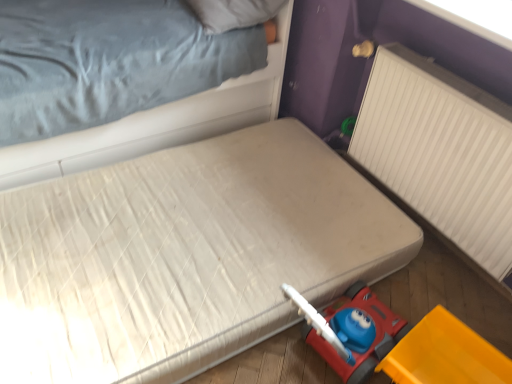
The image size is (512, 384). I want to click on white fabric bed at upper left, marked as the 1th bed in a top-to-bottom arrangement, so [156, 124].

In order to face white fabric bed at upper left, acting as the second bed starting from the bottom, should I rotate leftwards or rightwards?

Turn left approximately 17.500 degrees to face it.

The image size is (512, 384). What are the coordinates of `white ribbed radiator at right` in the screenshot? It's located at (440, 151).

Locate an element on the screen. white fabric bed at upper left, acting as the second bed starting from the bottom is located at coordinates (156, 124).

Between white fabric bed at upper left, marked as the 1th bed in a top-to-bottom arrangement, and white quilted mattress at lower right, marked as the 2th bed in a top-to-bottom arrangement, which one is positioned behind?

white fabric bed at upper left, marked as the 1th bed in a top-to-bottom arrangement, is further from the camera.

Considering the sizes of objects white fabric bed at upper left, marked as the 1th bed in a top-to-bottom arrangement, and white quilted mattress at lower right, marked as the 2th bed in a top-to-bottom arrangement, in the image provided, who is smaller, white fabric bed at upper left, marked as the 1th bed in a top-to-bottom arrangement, or white quilted mattress at lower right, marked as the 2th bed in a top-to-bottom arrangement,?

Smaller between the two is white quilted mattress at lower right, marked as the 2th bed in a top-to-bottom arrangement.

Which point is more forward, (209, 129) or (109, 196)?

The point (109, 196) is closer.

Are white fabric bed at upper left, acting as the second bed starting from the bottom, and white ribbed radiator at right located far from each other?

They are positioned close to each other.

Find the location of a particular element. This screenshot has width=512, height=384. radiator below the white fabric bed at upper left, acting as the second bed starting from the bottom (from a real-world perspective) is located at coordinates (440, 151).

Is white fabric bed at upper left, marked as the 1th bed in a top-to-bottom arrangement, taller than white ribbed radiator at right?

Indeed, white fabric bed at upper left, marked as the 1th bed in a top-to-bottom arrangement, has a greater height compared to white ribbed radiator at right.

In the scene shown: Is white fabric bed at upper left, marked as the 1th bed in a top-to-bottom arrangement, facing away from white ribbed radiator at right?

No, white ribbed radiator at right is not at the back of white fabric bed at upper left, marked as the 1th bed in a top-to-bottom arrangement.

Would you say white soft pillow at upper center is part of white fabric bed at upper left, acting as the second bed starting from the bottom,'s contents?

Yes, white fabric bed at upper left, acting as the second bed starting from the bottom, contains white soft pillow at upper center.

Considering the positions of points (277, 23) and (264, 18), is point (277, 23) closer to camera compared to point (264, 18)?

No, (277, 23) is behind (264, 18).

Is white fabric bed at upper left, acting as the second bed starting from the bottom, to the left or to the right of white soft pillow at upper center in the image?

Clearly, white fabric bed at upper left, acting as the second bed starting from the bottom, is on the left of white soft pillow at upper center in the image.

Is yellow plastic toy car at lower right placed right next to white soft pillow at upper center?

yellow plastic toy car at lower right and white soft pillow at upper center are not in contact.

Is yellow plastic toy car at lower right completely or partially outside of white soft pillow at upper center?

yellow plastic toy car at lower right is positioned outside white soft pillow at upper center.

In the scene shown: From a real-world perspective, between yellow plastic toy car at lower right and white soft pillow at upper center, who is vertically higher?

From a 3D spatial view, white soft pillow at upper center is above.

In the image, is yellow plastic toy car at lower right positioned in front of or behind white soft pillow at upper center?

In the image, yellow plastic toy car at lower right appears in front of white soft pillow at upper center.

Is white quilted mattress at lower right, the first bed when ordered from bottom to top, a part of white ribbed radiator at right?

No, white quilted mattress at lower right, the first bed when ordered from bottom to top, is not a part of white ribbed radiator at right.

Does white ribbed radiator at right have a larger size compared to white quilted mattress at lower right, the first bed when ordered from bottom to top?

Incorrect, white ribbed radiator at right is not larger than white quilted mattress at lower right, the first bed when ordered from bottom to top.

This screenshot has height=384, width=512. In order to click on bed in front of the white ribbed radiator at right in this screenshot , I will do `click(184, 255)`.

How different are the orientations of white ribbed radiator at right and white quilted mattress at lower right, marked as the 2th bed in a top-to-bottom arrangement, in degrees?

0.949 degrees separate the facing orientations of white ribbed radiator at right and white quilted mattress at lower right, marked as the 2th bed in a top-to-bottom arrangement.

Does white soft pillow at upper center have a greater height compared to white quilted mattress at lower right, the first bed when ordered from bottom to top?

No.

In order to click on pillow above the white quilted mattress at lower right, the first bed when ordered from bottom to top (from a real-world perspective) in this screenshot , I will do `click(233, 13)`.

From the image's perspective, relative to white quilted mattress at lower right, marked as the 2th bed in a top-to-bottom arrangement, is white soft pillow at upper center above or below?

From the image's perspective, white soft pillow at upper center appears above white quilted mattress at lower right, marked as the 2th bed in a top-to-bottom arrangement.

Which object is closer to the camera taking this photo, white soft pillow at upper center or white quilted mattress at lower right, the first bed when ordered from bottom to top?

Positioned in front is white quilted mattress at lower right, the first bed when ordered from bottom to top.

Image resolution: width=512 pixels, height=384 pixels. Identify the location of pillow above the white ribbed radiator at right (from a real-world perspective). (233, 13).

Is white ribbed radiator at right further to camera compared to white soft pillow at upper center?

No, white ribbed radiator at right is closer to the camera.

From the image's perspective, is white ribbed radiator at right over white soft pillow at upper center?

No.

Is white ribbed radiator at right thinner than white soft pillow at upper center?

Yes, white ribbed radiator at right is thinner than white soft pillow at upper center.

Locate an element on the screen. The height and width of the screenshot is (384, 512). bed below the white fabric bed at upper left, acting as the second bed starting from the bottom (from the image's perspective) is located at coordinates (184, 255).

The image size is (512, 384). I want to click on radiator in front of the white fabric bed at upper left, marked as the 1th bed in a top-to-bottom arrangement, so click(440, 151).

Which object lies further to the anchor point yellow plastic toy car at lower right, white ribbed radiator at right or white quilted mattress at lower right, marked as the 2th bed in a top-to-bottom arrangement?

The object further to yellow plastic toy car at lower right is white quilted mattress at lower right, marked as the 2th bed in a top-to-bottom arrangement.

From the image, which object appears to be farther from white fabric bed at upper left, marked as the 1th bed in a top-to-bottom arrangement, yellow plastic toy car at lower right or white soft pillow at upper center?

yellow plastic toy car at lower right is further to white fabric bed at upper left, marked as the 1th bed in a top-to-bottom arrangement.

Considering their positions, is yellow plastic toy car at lower right positioned further to white soft pillow at upper center than white ribbed radiator at right?

The object further to white soft pillow at upper center is yellow plastic toy car at lower right.

Based on their spatial positions, is white quilted mattress at lower right, marked as the 2th bed in a top-to-bottom arrangement, or white soft pillow at upper center closer to white fabric bed at upper left, acting as the second bed starting from the bottom?

Based on the image, white soft pillow at upper center appears to be nearer to white fabric bed at upper left, acting as the second bed starting from the bottom.

When comparing their distances from yellow plastic toy car at lower right, does white fabric bed at upper left, marked as the 1th bed in a top-to-bottom arrangement, or white ribbed radiator at right seem further?

white fabric bed at upper left, marked as the 1th bed in a top-to-bottom arrangement, lies further to yellow plastic toy car at lower right than the other object.

Based on their spatial positions, is white quilted mattress at lower right, marked as the 2th bed in a top-to-bottom arrangement, or white ribbed radiator at right further from white fabric bed at upper left, acting as the second bed starting from the bottom?

Based on the image, white ribbed radiator at right appears to be further to white fabric bed at upper left, acting as the second bed starting from the bottom.

Estimate the real-world distances between objects in this image. Which object is further from yellow plastic toy car at lower right, white quilted mattress at lower right, marked as the 2th bed in a top-to-bottom arrangement, or white ribbed radiator at right?

Among the two, white quilted mattress at lower right, marked as the 2th bed in a top-to-bottom arrangement, is located further to yellow plastic toy car at lower right.

Considering their positions, is white quilted mattress at lower right, marked as the 2th bed in a top-to-bottom arrangement, positioned closer to yellow plastic toy car at lower right than white soft pillow at upper center?

white quilted mattress at lower right, marked as the 2th bed in a top-to-bottom arrangement.

Identify the location of equipment located between white quilted mattress at lower right, marked as the 2th bed in a top-to-bottom arrangement, and white ribbed radiator at right in the left-right direction. (445, 354).

Identify the location of radiator between white soft pillow at upper center and white quilted mattress at lower right, the first bed when ordered from bottom to top, in the vertical direction. This screenshot has width=512, height=384. (440, 151).

Find the location of a particular element. This screenshot has height=384, width=512. bed between white fabric bed at upper left, marked as the 1th bed in a top-to-bottom arrangement, and yellow plastic toy car at lower right, in the vertical direction is located at coordinates (184, 255).

Locate an element on the screen. This screenshot has width=512, height=384. radiator between white soft pillow at upper center and yellow plastic toy car at lower right from top to bottom is located at coordinates (440, 151).